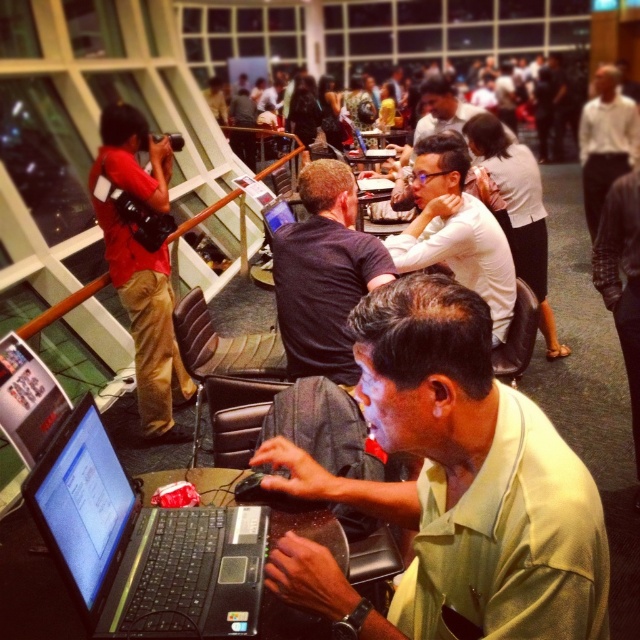
From the picture: Between black glossy laptop at lower left and white shirt at upper right, which one appears on the left side from the viewer's perspective?

From the viewer's perspective, black glossy laptop at lower left appears more on the left side.

Is point (70, 404) closer to viewer compared to point (579, 144)?

Yes, point (70, 404) is in front of point (579, 144).

Where is `black glossy laptop at lower left`? black glossy laptop at lower left is located at coordinates (28, 400).

Who is more forward, (x=1, y=371) or (x=397, y=138)?

Point (x=1, y=371)

Can you confirm if black glossy laptop at lower left is bigger than matte black laptop at center?

No.

Does point (28, 403) come behind point (381, 156)?

No.

Locate an element on the screen. black glossy laptop at lower left is located at coordinates (28, 400).

Does black plastic laptop at lower left have a smaller size compared to dark brown shirt at center?

Yes, black plastic laptop at lower left is smaller than dark brown shirt at center.

Is point (156, 532) behind point (342, 346)?

That is False.

Does point (209, 588) come farther from viewer compared to point (324, 296)?

That is False.

Locate an element on the screen. black plastic laptop at lower left is located at coordinates (141, 545).